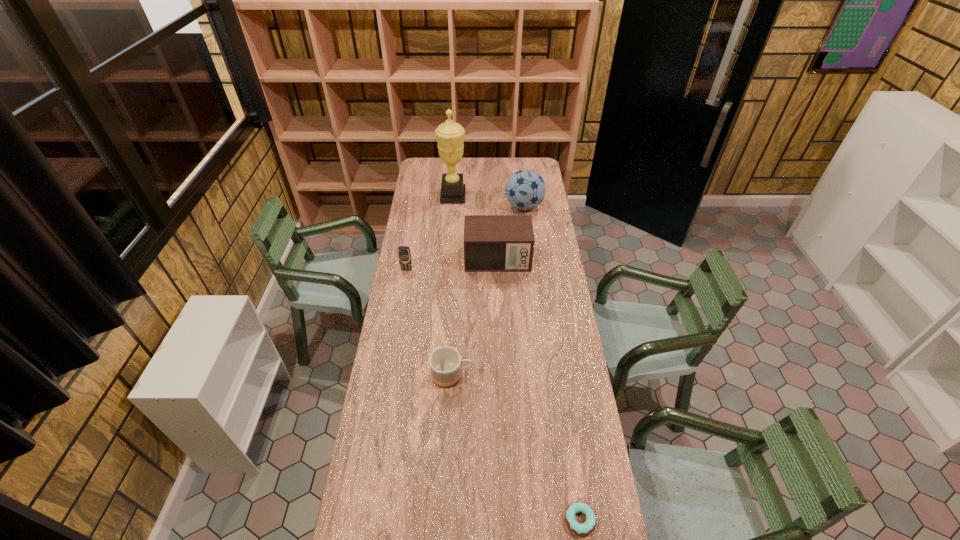
Locate an element on the screen. The width and height of the screenshot is (960, 540). vacant area located 0.240m on the side with brand of the soccer ball is located at coordinates click(529, 247).

Locate an element on the screen. The width and height of the screenshot is (960, 540). free space located on the front-facing side of the radio receiver is located at coordinates (499, 301).

Where is `blank space located 0.140m on the front face of the leftmost object`? blank space located 0.140m on the front face of the leftmost object is located at coordinates (403, 292).

Image resolution: width=960 pixels, height=540 pixels. What are the coordinates of `vacant space located 0.240m on the side with the handle of the fifth tallest object` in the screenshot? It's located at (535, 376).

Where is `vacant region located on the back of the shortest object`? The height and width of the screenshot is (540, 960). vacant region located on the back of the shortest object is located at coordinates (562, 399).

Where is `trophy cup located in the left edge section of the desktop`? The width and height of the screenshot is (960, 540). trophy cup located in the left edge section of the desktop is located at coordinates (450, 135).

This screenshot has width=960, height=540. In order to click on cellular telephone situated at the left edge in this screenshot , I will do `click(404, 255)`.

At what (x,y) coordinates should I click in order to perform the action: click on soccer ball present at the right edge. Please return your answer as a coordinate pair (x, y). Looking at the image, I should click on point(525,189).

Find the location of a particular element. The image size is (960, 540). radio receiver that is at the right edge is located at coordinates (492, 243).

Locate an element on the screen. doughnut that is at the right edge is located at coordinates [x=586, y=528].